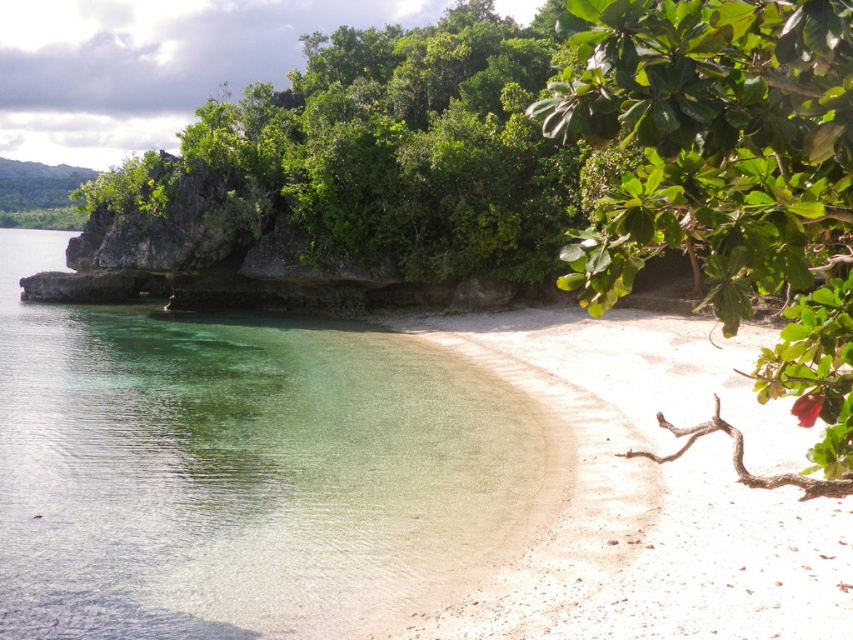
You are standing on the beach and looking at the green leafy tree at upper right and the green leafy rock at upper left. Which one is positioned lower in the image?

The green leafy tree at upper right is positioned lower than the green leafy rock at upper left.

You are standing on the beach looking towards the water. There is a point marked at coordinates (236, 467). Can you tell me what is located at that point?

The point at coordinates (236, 467) corresponds to clear water at lower left.